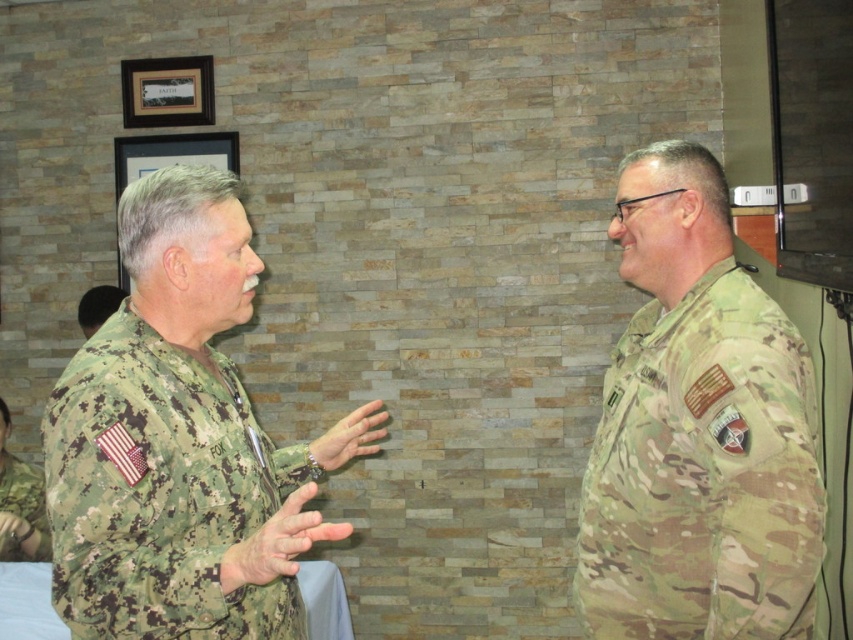
Between point (201, 435) and point (16, 465), which one is positioned in front?

Point (201, 435) is more forward.

Which is behind, point (94, 394) or point (10, 465)?

The point (10, 465) is more distant.

Find the location of a particular element. The width and height of the screenshot is (853, 640). digital camouflage uniform at left is located at coordinates (160, 492).

Which is above, camouflage uniform at left or camouflage uniform at center?

Positioned higher is camouflage uniform at center.

In the scene shown: Does camouflage uniform at left come behind camouflage uniform at center?

That is False.

What do you see at coordinates (20, 502) in the screenshot?
I see `camouflage uniform at left` at bounding box center [20, 502].

Locate an element on the screen. The width and height of the screenshot is (853, 640). camouflage uniform at left is located at coordinates (20, 502).

Does digital camouflage uniform at left have a lesser height compared to camouflage uniform at center?

In fact, digital camouflage uniform at left may be taller than camouflage uniform at center.

Who is more distant from viewer, (99, 372) or (94, 288)?

Positioned behind is point (94, 288).

What are the coordinates of `digital camouflage uniform at left` in the screenshot? It's located at (x=160, y=492).